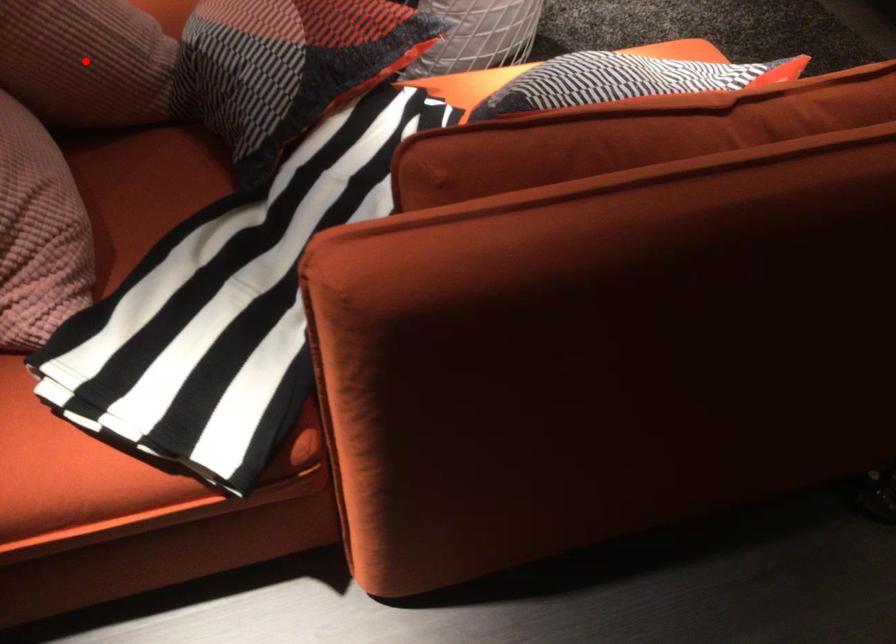
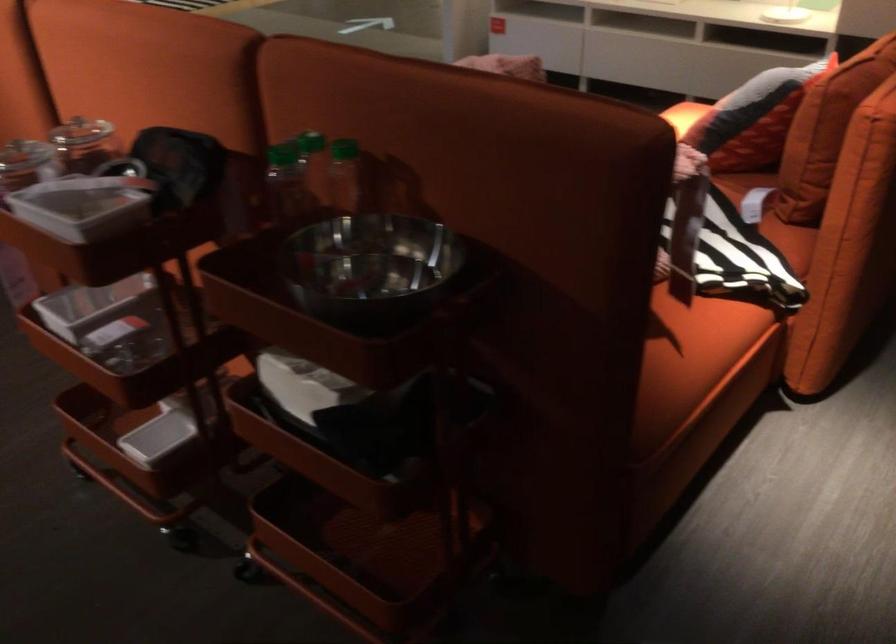
Question: I am providing you with two images of the same scene from different viewpoints. A red point is marked on the first image. Is the red point's position out of view in image 2?

Choices:
 (A) Yes
 (B) No

Answer: (A)